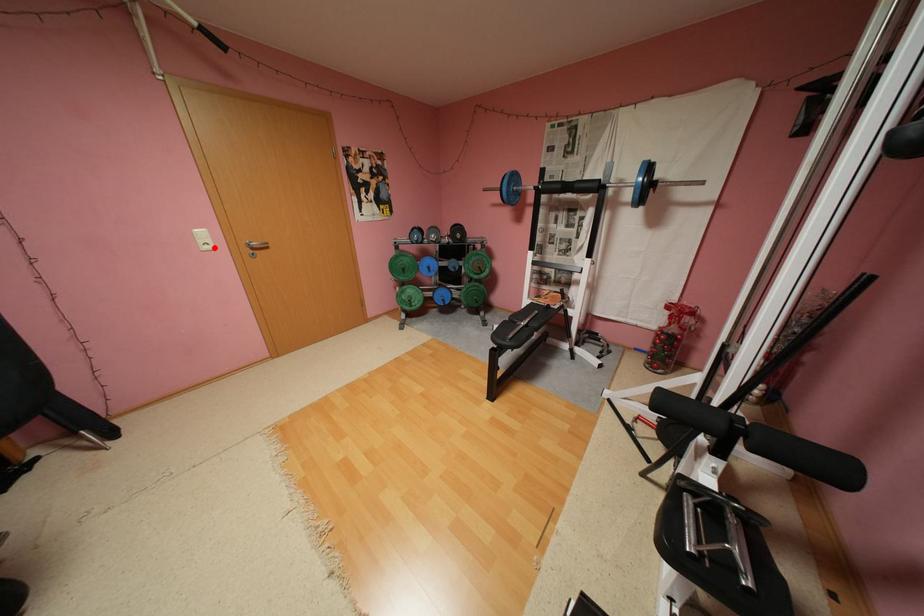
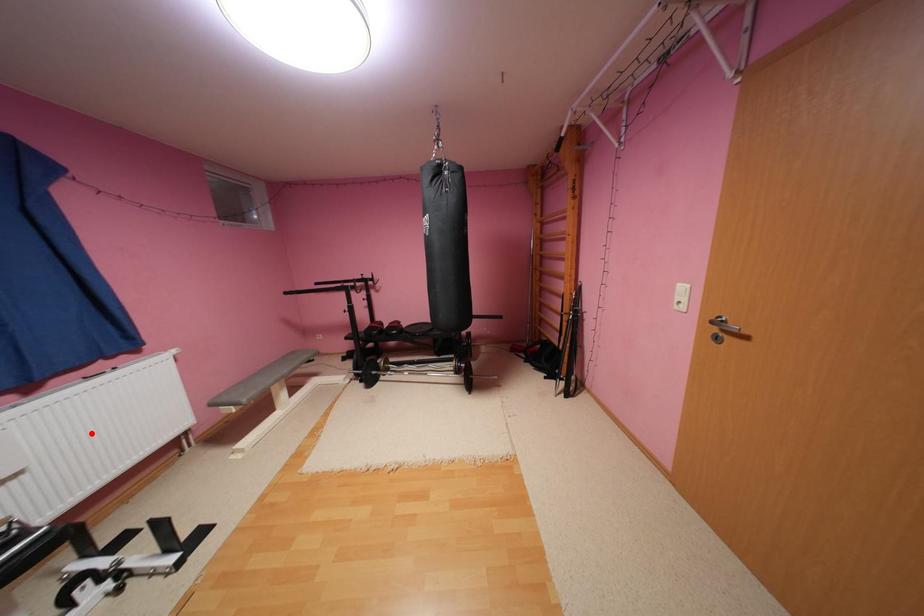
I am providing you with two images of the same scene from different viewpoints. A red point is marked on the first image and another point is marked on the second image. Are the points marked in image1 and image2 representing the same 3D position?

No